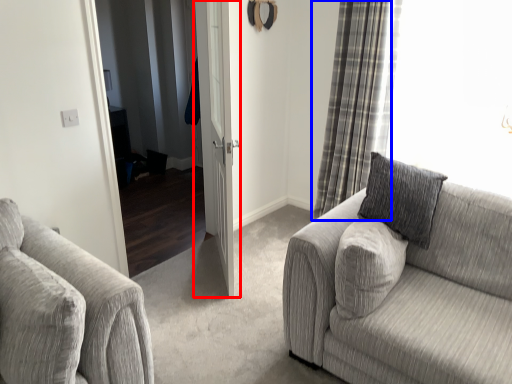
Question: Which point is further to the camera, door (highlighted by a red box) or curtain (highlighted by a blue box)?

Choices:
 (A) door
 (B) curtain

Answer: (B)